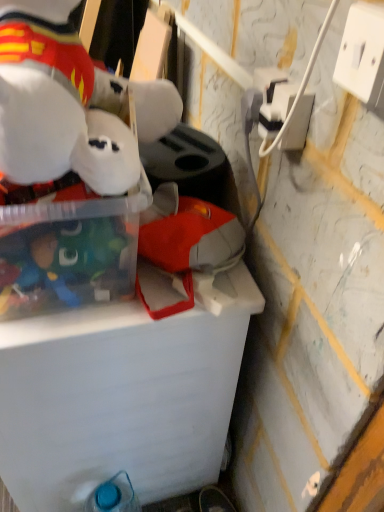
Question: From a real-world perspective, is transparent plastic storage box at upper left positioned above or below transparent plastic container at upper left?

Choices:
 (A) below
 (B) above

Answer: (B)

Question: From the image's perspective, relative to transparent plastic container at upper left, is transparent plastic storage box at upper left above or below?

Choices:
 (A) below
 (B) above

Answer: (B)

Question: Which is farther from the blue plastic bottle at lower left?

Choices:
 (A) white plastic power outlet at upper right, arranged as the 1th power outlet when viewed from the front
 (B) white plush toy at upper left
 (C) white plastic power outlet at upper right, marked as the second power outlet in a front-to-back arrangement
 (D) transparent plastic storage box at upper left
 (E) transparent plastic container at upper left

Answer: (A)

Question: Based on their relative distances, which object is nearer to the transparent plastic storage box at upper left?

Choices:
 (A) white plastic power outlet at upper right, the 2th power outlet when ordered from left to right
 (B) white plush toy at upper left
 (C) transparent plastic container at upper left
 (D) white plastic power outlet at upper right, which is the 1th power outlet from left to right
 (E) blue plastic bottle at lower left

Answer: (B)